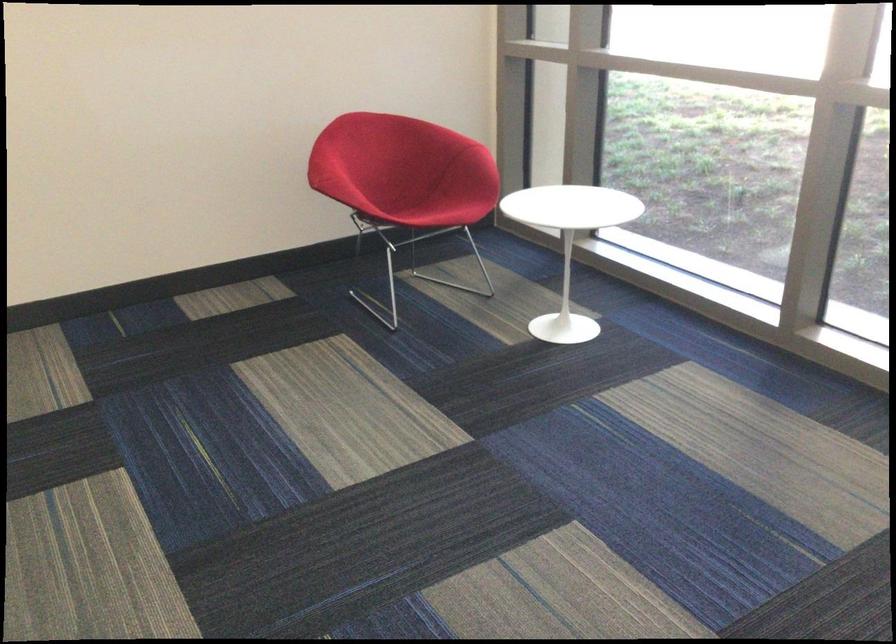
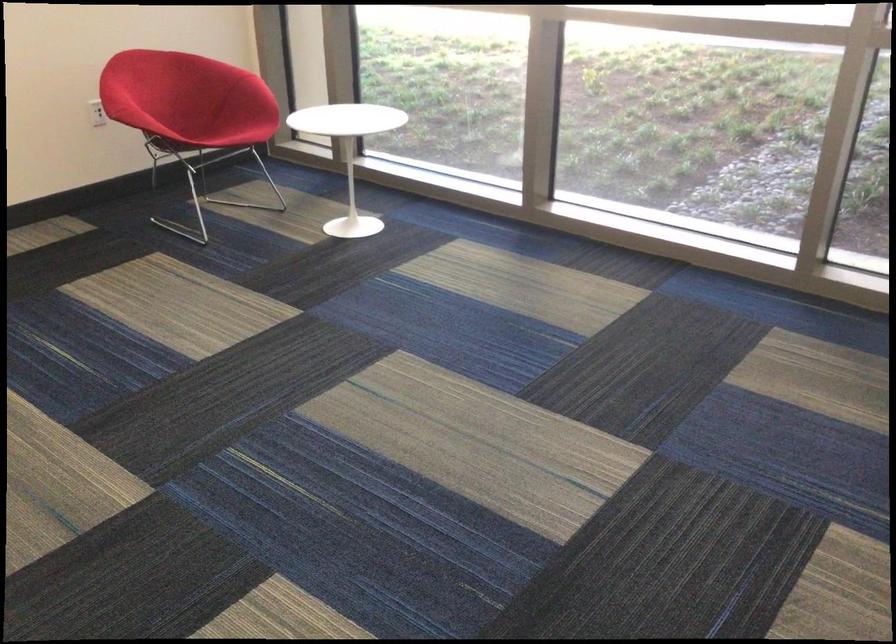
Question: The camera is either moving clockwise (left) or counter-clockwise (right) around the object. The first image is from the beginning of the video and the second image is from the end. Is the camera moving left or right when shooting the video?

Choices:
 (A) Left
 (B) Right

Answer: (A)